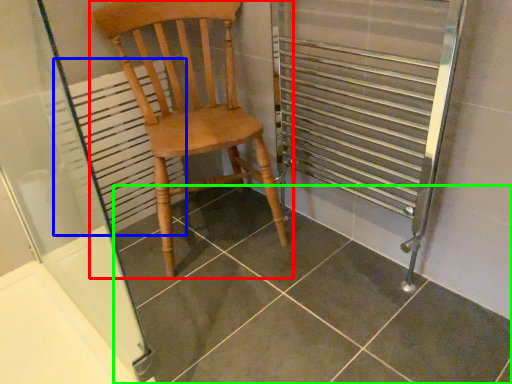
Question: Which object is the closest to the chair (highlighted by a red box)? Choose among these: radiator (highlighted by a blue box) or tile (highlighted by a green box).

Choices:
 (A) radiator
 (B) tile

Answer: (A)